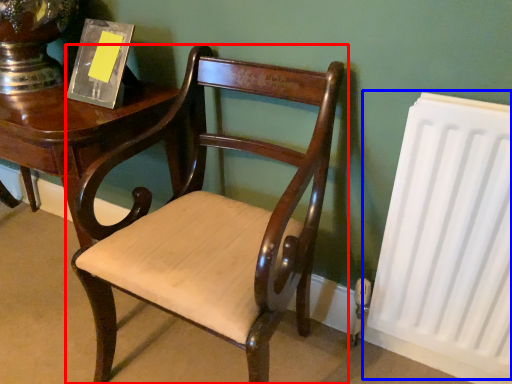
Question: Among these objects, which one is farthest to the camera, chair (highlighted by a red box) or radiator (highlighted by a blue box)?

Choices:
 (A) chair
 (B) radiator

Answer: (B)